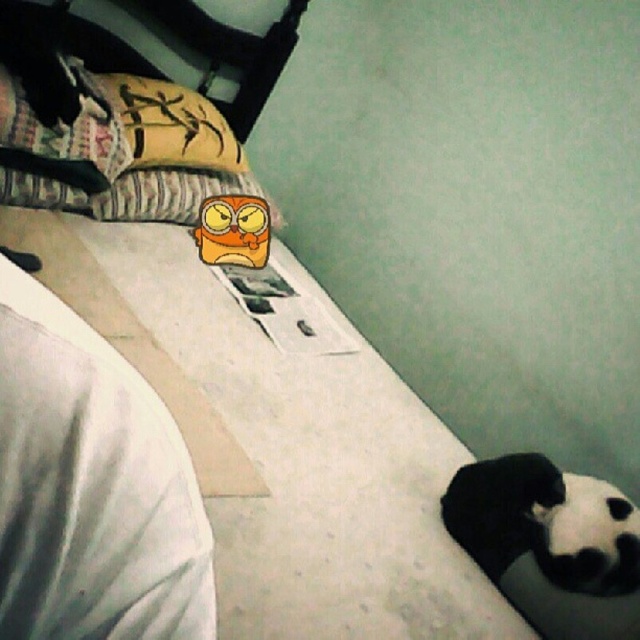
You are organizing a toy collection and see the black plush panda at lower right and the orange plush toy at center. Which toy is located below the other?

The black plush panda at lower right is positioned under the orange plush toy at center.